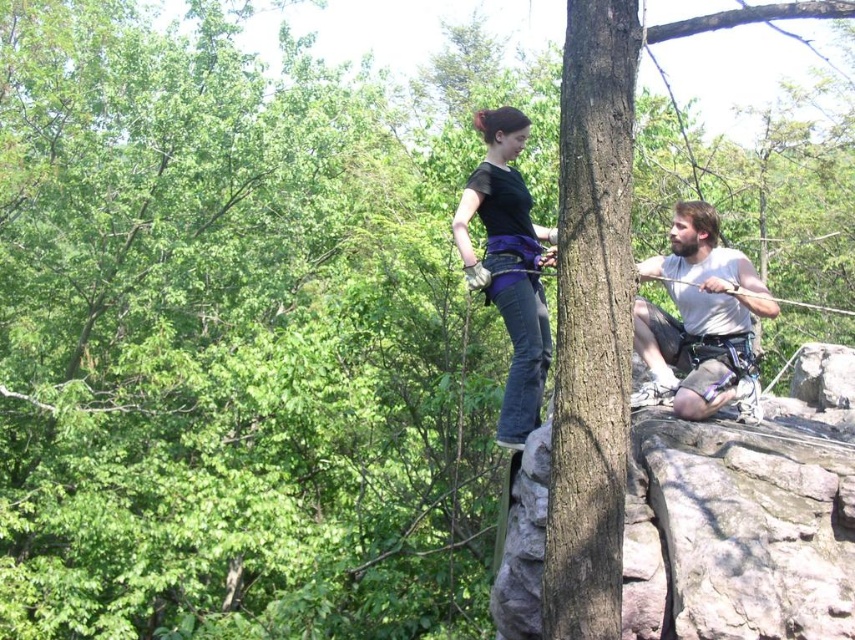
Is light gray fabric shorts at right to the right of black matte pants at center from the viewer's perspective?

Yes, light gray fabric shorts at right is to the right of black matte pants at center.

Who is shorter, light gray fabric shorts at right or black matte pants at center?

Standing shorter between the two is light gray fabric shorts at right.

What are the coordinates of `light gray fabric shorts at right` in the screenshot? It's located at (699, 320).

Locate an element on the screen. light gray fabric shorts at right is located at coordinates (699, 320).